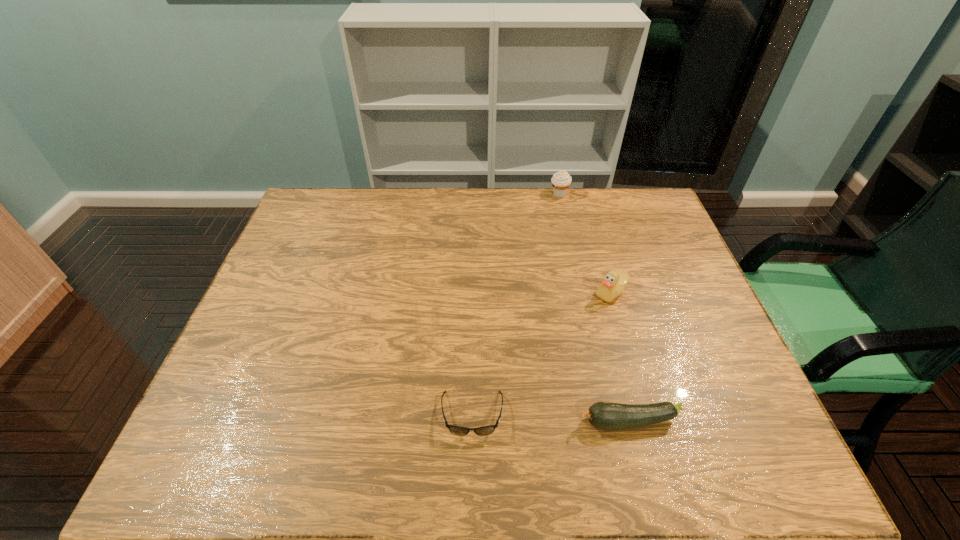
The height and width of the screenshot is (540, 960). In order to click on vacant space situated at the blossom end of the zucchini in this screenshot , I will do pos(482,422).

Identify the location of free space located 0.210m at the blossom end of the zucchini. (482, 422).

Locate an element on the screen. vacant space located 0.060m on the front-facing side of the sunglasses is located at coordinates (471, 468).

Image resolution: width=960 pixels, height=540 pixels. Identify the location of object present at the far edge. (561, 180).

This screenshot has width=960, height=540. Identify the location of zucchini that is positioned at the near edge. (603, 415).

The width and height of the screenshot is (960, 540). Identify the location of sunglasses located in the near edge section of the desktop. (456, 430).

The image size is (960, 540). Find the location of `free space at the far edge`. free space at the far edge is located at coordinates (524, 197).

Where is `vacant space at the near edge of the desktop`? vacant space at the near edge of the desktop is located at coordinates (517, 464).

In the image, there is a desktop. Where is `free space at the left edge`? The height and width of the screenshot is (540, 960). free space at the left edge is located at coordinates pyautogui.click(x=295, y=285).

The image size is (960, 540). Find the location of `free space at the right edge of the desktop`. free space at the right edge of the desktop is located at coordinates (648, 274).